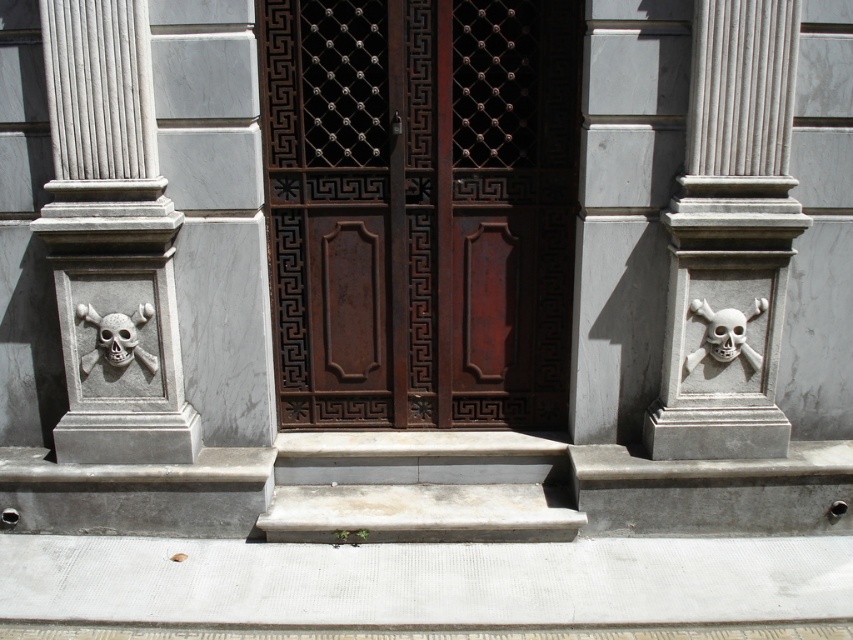
The width and height of the screenshot is (853, 640). Describe the element at coordinates (111, 237) in the screenshot. I see `white marble skull at left` at that location.

Does white marble skull at left come behind white stone skull at right?

That is False.

Which is in front, point (59, 291) or point (704, 300)?

Point (59, 291) is in front.

This screenshot has width=853, height=640. I want to click on white marble skull at left, so click(x=111, y=237).

Is white concrete stairs at center wider than white matte skull at lower left?

Yes, white concrete stairs at center is wider than white matte skull at lower left.

Does white concrete stairs at center have a smaller size compared to white matte skull at lower left?

No, white concrete stairs at center is not smaller than white matte skull at lower left.

Locate an element on the screen. The width and height of the screenshot is (853, 640). white concrete stairs at center is located at coordinates (419, 486).

The image size is (853, 640). In order to click on white concrete stairs at center in this screenshot , I will do `click(419, 486)`.

Between rusty wood door at center and white marble skull at left, which one has more height?

Standing taller between the two is white marble skull at left.

Can you confirm if rusty wood door at center is smaller than white marble skull at left?

No, rusty wood door at center is not smaller than white marble skull at left.

Which is in front, point (509, 390) or point (126, 403)?

Point (126, 403)

Find the location of a particular element. rusty wood door at center is located at coordinates (421, 209).